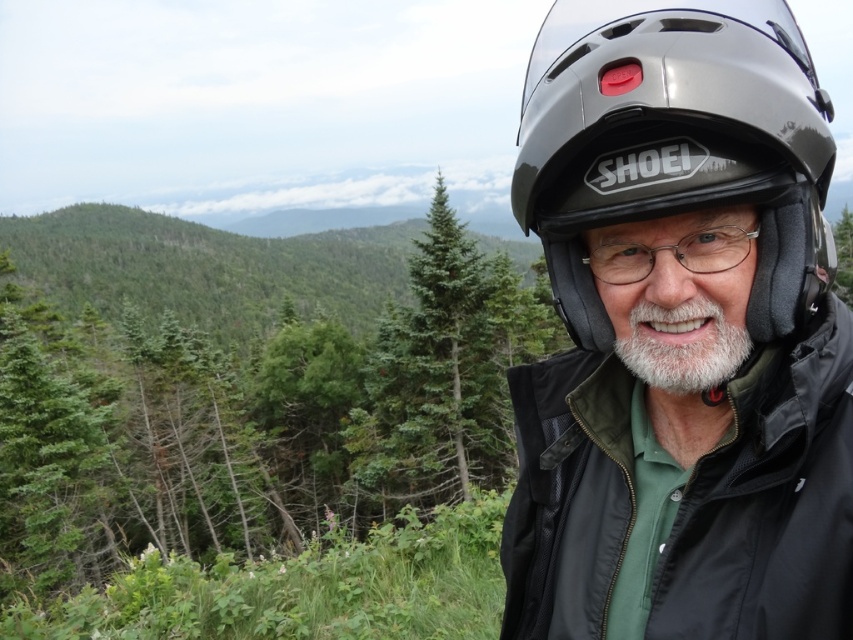
Is glossy black helmet at upper right wider than clear plastic glasses at center?

Yes.

Does point (633, 163) lie behind point (608, 252)?

That is False.

Between point (796, 172) and point (602, 280), which one is positioned behind?

Point (602, 280)

Find the location of a particular element. This screenshot has width=853, height=640. glossy black helmet at upper right is located at coordinates (675, 141).

Between point (822, 554) and point (647, 196), which one is positioned behind?

The point (822, 554) is behind.

Is black matte jacket at right shorter than glossy black helmet at upper right?

Yes.

The image size is (853, 640). I want to click on black matte jacket at right, so click(x=770, y=502).

Locate an element on the screen. black matte jacket at right is located at coordinates (770, 502).

Is black matte jacket at right to the left of clear plastic glasses at center from the viewer's perspective?

Correct, you'll find black matte jacket at right to the left of clear plastic glasses at center.

Is point (837, 573) positioned behind point (711, 252)?

No, it is in front of (711, 252).

Is point (577, 451) more distant than point (717, 243)?

Yes.

I want to click on black matte jacket at right, so [770, 502].